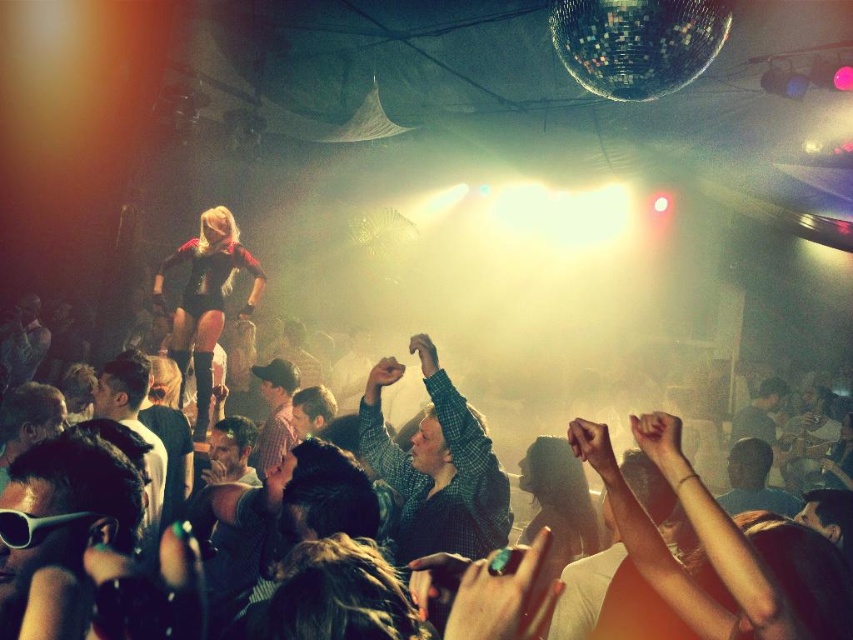
From the picture: You are a photographer at the nightclub trying to capture a candid shot of both the green checkered shirt at center and the black leather outfit at center. Since you want to include both subjects in the frame, which subject should you focus on to ensure both are in focus?

The photographer should focus on the black leather outfit at center because it is larger in size compared to the green checkered shirt at center, making it easier to ensure both are in focus.

You are a photographer at the nightclub and want to capture both the green checkered shirt at center and the black leather outfit at center in a single photo. Which of the two should you focus on first to ensure they are both in frame?

The green checkered shirt at center is shorter than the black leather outfit at center, so you should focus on the green checkered shirt at center first to ensure both are in frame.